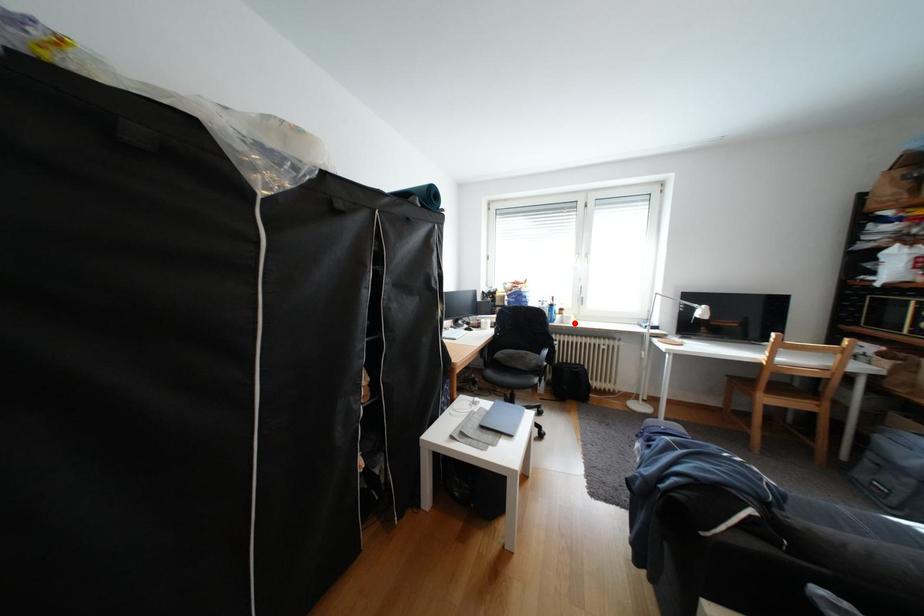
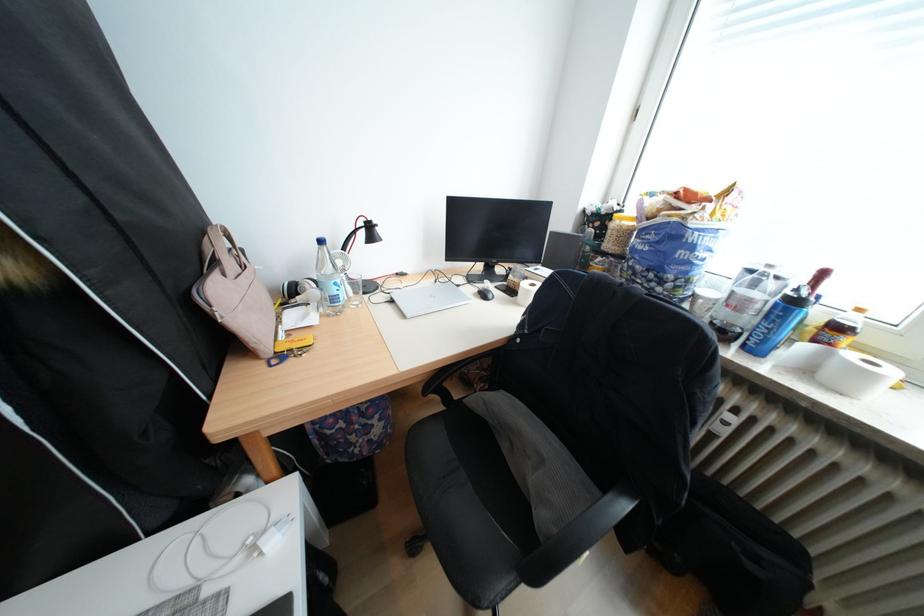
Where in the second image is the point corresponding to the highlighted location from the first image?

(821, 371)